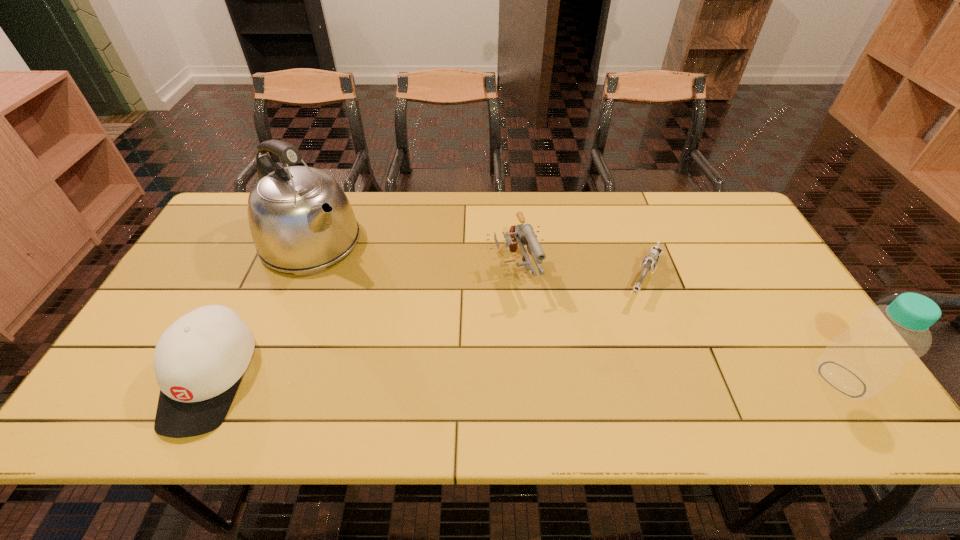
Find the location of a particular element. Image resolution: width=960 pixels, height=540 pixels. vacant space located 0.250m at the barrel end of the third object from left to right is located at coordinates (557, 383).

Identify the location of vacant space situated at the barrel end of the third object from left to right. (555, 380).

What are the coordinates of `vacant space located 0.170m aimed along the barrel of the shorter gun` in the screenshot? It's located at (617, 348).

The image size is (960, 540). I want to click on vacant region located 0.130m aimed along the barrel of the shorter gun, so click(623, 337).

Image resolution: width=960 pixels, height=540 pixels. In order to click on vacant space located 0.080m aimed along the barrel of the shorter gun in this screenshot , I will do `click(629, 323)`.

You are a GUI agent. You are given a task and a screenshot of the screen. Output one action in this format:
    pyautogui.click(x=<x>, y=<y>)
    Task: Click on the vacant area situated on the spout of the tallest object
    The height and width of the screenshot is (540, 960).
    Given the screenshot: What is the action you would take?
    pyautogui.click(x=370, y=293)

You are a GUI agent. You are given a task and a screenshot of the screen. Output one action in this format:
    pyautogui.click(x=<x>, y=<y>)
    Task: Click on the blank area located 0.230m on the spout of the tallest object
    
    Given the screenshot: What is the action you would take?
    pyautogui.click(x=388, y=309)

You are a GUI agent. You are given a task and a screenshot of the screen. Output one action in this format:
    pyautogui.click(x=<x>, y=<y>)
    Task: Click on the free space located 0.360m on the spout of the tallest object
    The image size is (960, 540).
    Given the screenshot: What is the action you would take?
    pyautogui.click(x=420, y=337)

You are a GUI agent. You are given a task and a screenshot of the screen. Output one action in this format:
    pyautogui.click(x=<x>, y=<y>)
    Task: Click on the object that is positioned at the far edge
    This screenshot has height=540, width=960.
    Given the screenshot: What is the action you would take?
    pyautogui.click(x=301, y=221)

Where is `baseball cap that is positioned at the near edge`? This screenshot has width=960, height=540. baseball cap that is positioned at the near edge is located at coordinates (199, 361).